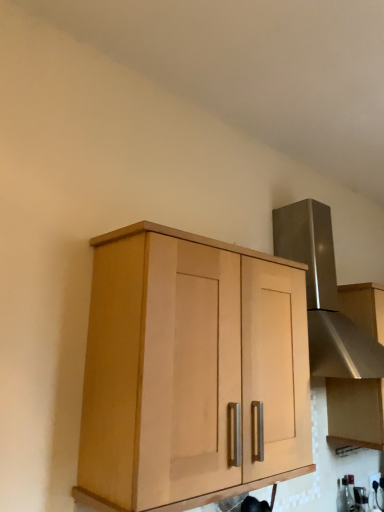
Question: From a real-world perspective, is light wood cabinet at center, which is counted as the 2th cabinetry, starting from the back, under satin silver hood at upper right, acting as the 1th cabinetry starting from the back?

Choices:
 (A) yes
 (B) no

Answer: (A)

Question: Can you confirm if light wood cabinet at center, marked as the first cabinetry in a left-to-right arrangement, is thinner than satin silver hood at upper right, placed as the second cabinetry when sorted from left to right?

Choices:
 (A) no
 (B) yes

Answer: (A)

Question: From the image's perspective, is light wood cabinet at center, marked as the first cabinetry in a left-to-right arrangement, under satin silver hood at upper right, placed as the second cabinetry when sorted from left to right?

Choices:
 (A) yes
 (B) no

Answer: (B)

Question: Does light wood cabinet at center, which is counted as the 2th cabinetry, starting from the back, turn towards satin silver hood at upper right, acting as the 1th cabinetry starting from the back?

Choices:
 (A) no
 (B) yes

Answer: (A)

Question: Is light wood cabinet at center, the first cabinetry from the front, positioned with its back to satin silver hood at upper right, acting as the 1th cabinetry starting from the back?

Choices:
 (A) yes
 (B) no

Answer: (B)

Question: In terms of height, does white glossy electric outlet at lower right look taller or shorter compared to light wood cabinet at center, which is counted as the 2th cabinetry, starting from the back?

Choices:
 (A) short
 (B) tall

Answer: (A)

Question: Is white glossy electric outlet at lower right in front of or behind light wood cabinet at center, marked as the first cabinetry in a left-to-right arrangement, in the image?

Choices:
 (A) front
 (B) behind

Answer: (B)

Question: Based on their sizes in the image, would you say white glossy electric outlet at lower right is bigger or smaller than light wood cabinet at center, marked as the first cabinetry in a left-to-right arrangement?

Choices:
 (A) small
 (B) big

Answer: (A)

Question: From a real-world perspective, is white glossy electric outlet at lower right above or below light wood cabinet at center, the first cabinetry from the front?

Choices:
 (A) above
 (B) below

Answer: (B)

Question: Is point (329, 440) positioned closer to the camera than point (347, 488)?

Choices:
 (A) closer
 (B) farther

Answer: (A)

Question: Considering their positions, is satin silver hood at upper right, acting as the 1th cabinetry starting from the back, located in front of or behind clear glass bottle at lower right?

Choices:
 (A) front
 (B) behind

Answer: (A)

Question: Is satin silver hood at upper right, arranged as the second cabinetry when viewed from the front, wider or thinner than clear glass bottle at lower right?

Choices:
 (A) thin
 (B) wide

Answer: (B)

Question: Looking at the image, does satin silver hood at upper right, which is the 1th cabinetry in right-to-left order, seem bigger or smaller compared to clear glass bottle at lower right?

Choices:
 (A) big
 (B) small

Answer: (A)

Question: Is clear glass bottle at lower right taller or shorter than satin silver vent at upper right?

Choices:
 (A) tall
 (B) short

Answer: (B)

Question: Choose the correct answer: Is clear glass bottle at lower right inside satin silver vent at upper right or outside it?

Choices:
 (A) outside
 (B) inside

Answer: (A)